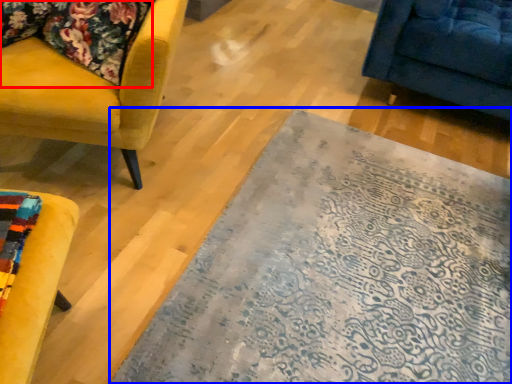
Question: Which object appears closest to the camera in this image, fabric (highlighted by a red box) or mat (highlighted by a blue box)?

Choices:
 (A) fabric
 (B) mat

Answer: (B)